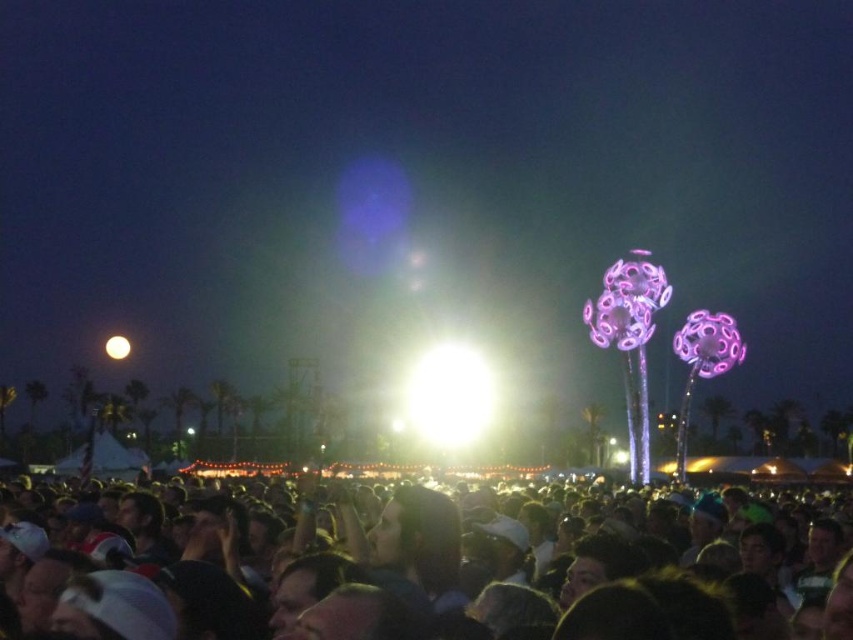
Between point (442, 566) and point (126, 348), which one is positioned behind?

Positioned behind is point (126, 348).

Who is lower down, dark matte crowd at center or bright white sphere at upper center?

dark matte crowd at center

Is point (590, 612) positioned after point (115, 336)?

No, (590, 612) is closer to viewer.

In order to click on dark matte crowd at center in this screenshot , I will do `click(524, 588)`.